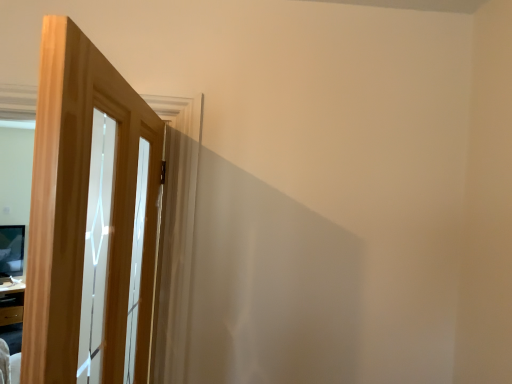
Measure the distance between matte black monitor at left and camera.

They are 2.62 meters apart.

Identify the location of matte black monitor at left. This screenshot has width=512, height=384. (11, 250).

What do you see at coordinates (11, 250) in the screenshot?
I see `matte black monitor at left` at bounding box center [11, 250].

Where is `matte black monitor at left`? matte black monitor at left is located at coordinates (11, 250).